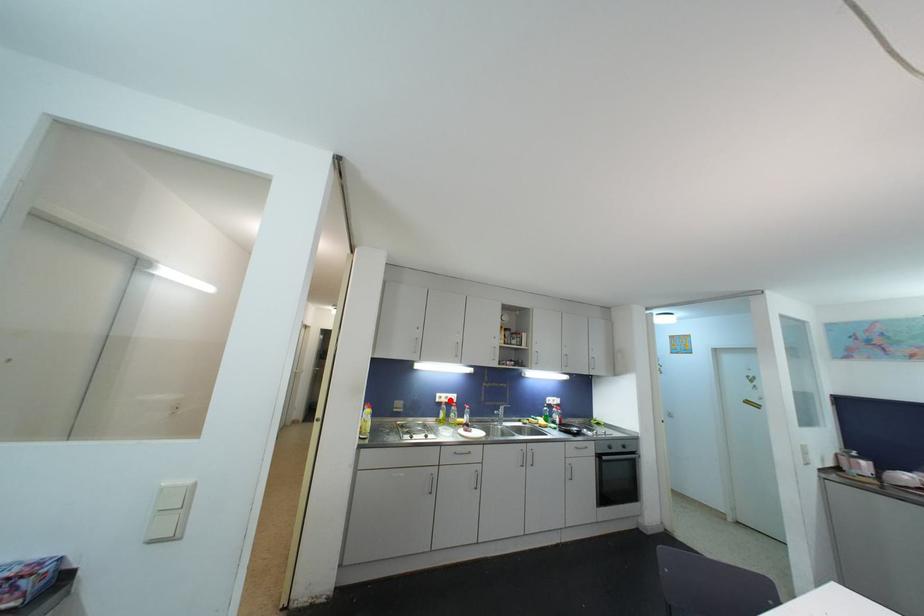
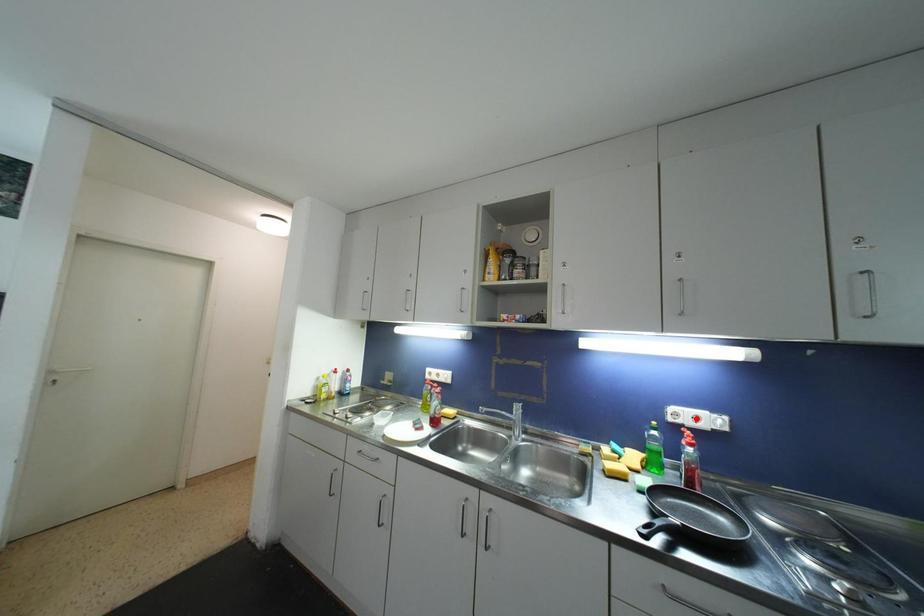
I am providing you with two images of the same scene from different viewpoints. A red point is marked on the first image and another point is marked on the second image. Does the point marked in image1 correspond to the same location as the one in image2?

No